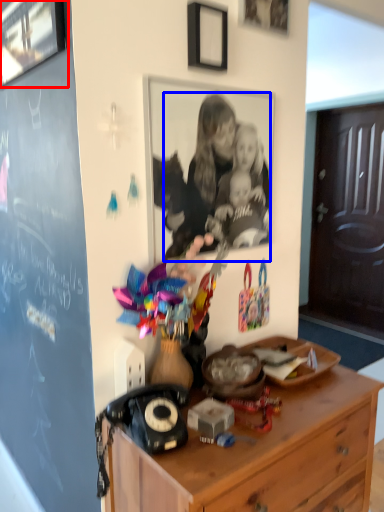
Question: Which object appears closest to the camera in this image, picture frame (highlighted by a red box) or person (highlighted by a blue box)?

Choices:
 (A) picture frame
 (B) person

Answer: (A)